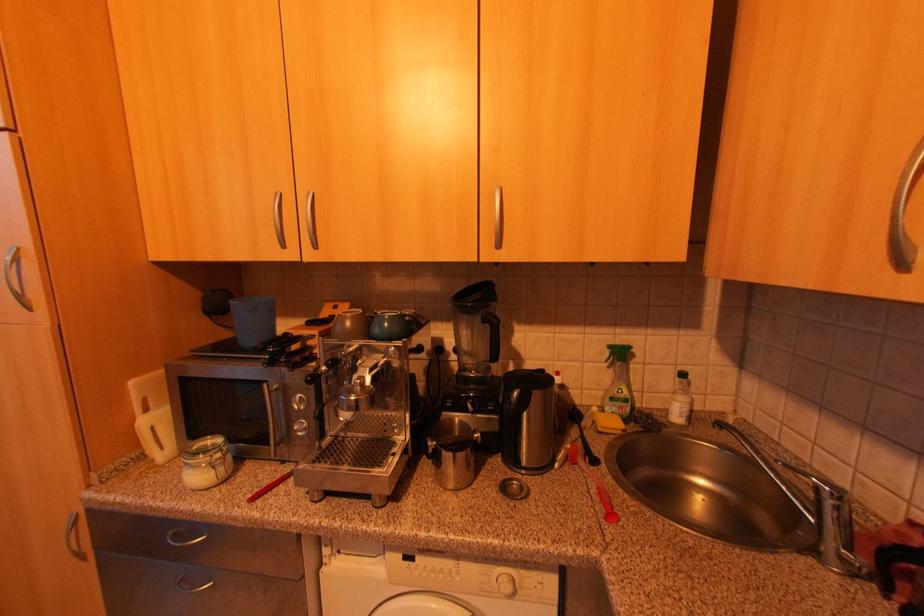
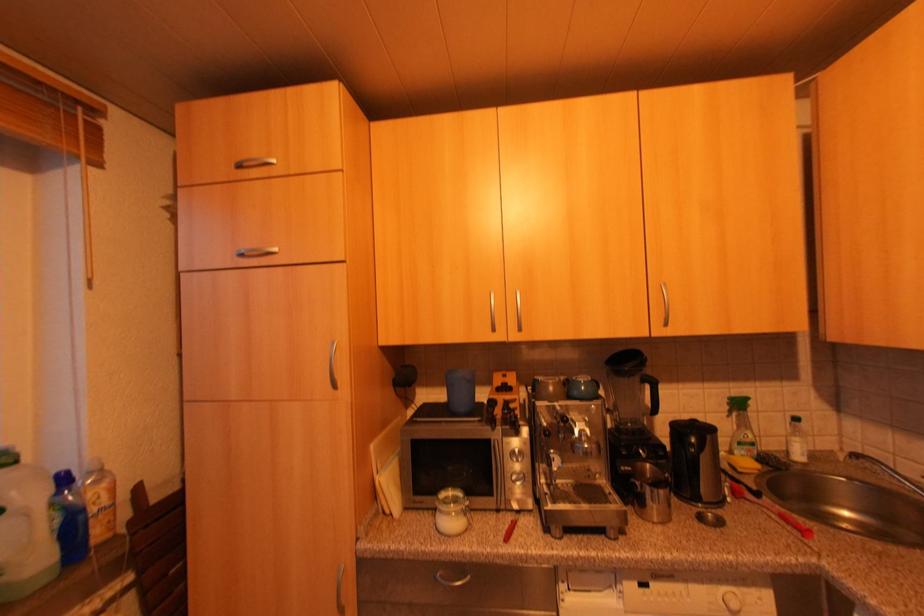
Consider the image. Which direction would the cameraman need to move to produce the second image?

The cameraman walked toward left, backward.